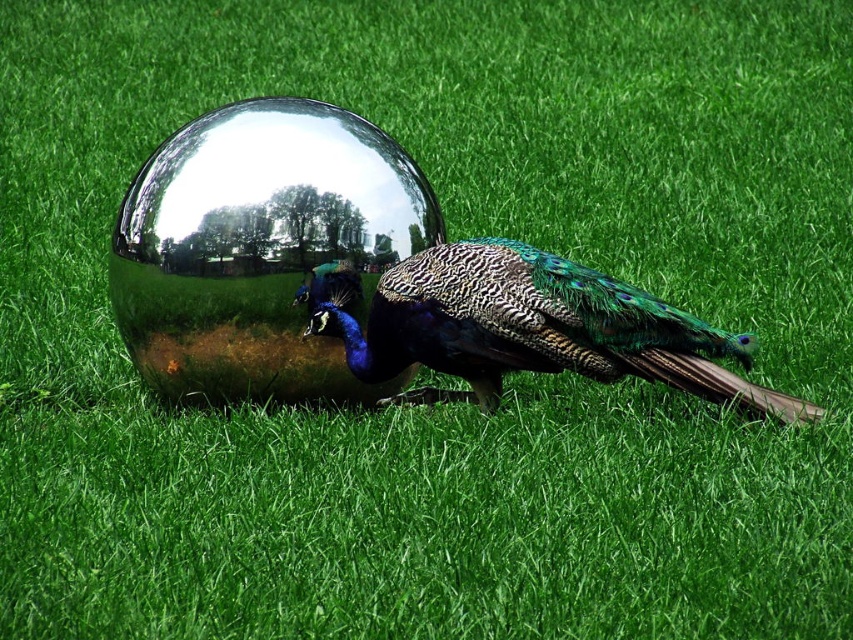
Question: Does shiny metallic sphere at center appear under shiny metallic tail at center?

Choices:
 (A) yes
 (B) no

Answer: (B)

Question: Which object is the farthest from the shiny metallic sphere at center?

Choices:
 (A) shiny metallic peacock at center
 (B) shiny metallic tail at center

Answer: (B)

Question: From the image, what is the correct spatial relationship of shiny metallic sphere at center in relation to shiny metallic peacock at center?

Choices:
 (A) right
 (B) left

Answer: (B)

Question: Which of the following is the farthest from the observer?

Choices:
 (A) (154, 307)
 (B) (525, 253)
 (C) (664, 356)

Answer: (A)

Question: Which point appears farthest from the camera in this image?

Choices:
 (A) (637, 355)
 (B) (270, 394)

Answer: (B)

Question: Is shiny metallic sphere at center below shiny metallic peacock at center?

Choices:
 (A) yes
 (B) no

Answer: (B)